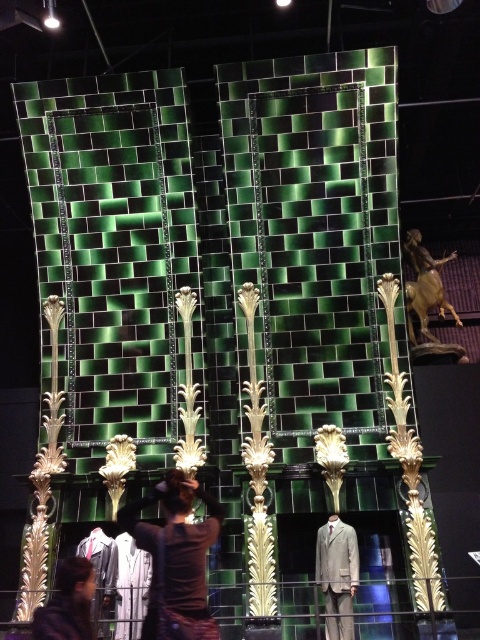
Is point (339, 554) behind point (61, 602)?

Yes, it is behind point (61, 602).

Locate an element on the screen. matte gray suit at center is located at coordinates (336, 564).

Can you confirm if brown fabric at center is positioned to the left of dark brown leather jacket at lower left?

In fact, brown fabric at center is to the right of dark brown leather jacket at lower left.

From the picture: Can you confirm if brown fabric at center is positioned below dark brown leather jacket at lower left?

No.

Where is `brown fabric at center`? brown fabric at center is located at coordinates (176, 557).

At what (x,y) coordinates should I click in order to perform the action: click on brown fabric at center. Please return your answer as a coordinate pair (x, y). The image size is (480, 640). Looking at the image, I should click on (176, 557).

Is point (175, 602) farther from camera compared to point (330, 611)?

No, it is in front of (330, 611).

Which is above, brown fabric at center or matte gray suit at center?

brown fabric at center is higher up.

Where is `brown fabric at center`? Image resolution: width=480 pixels, height=640 pixels. brown fabric at center is located at coordinates (176, 557).